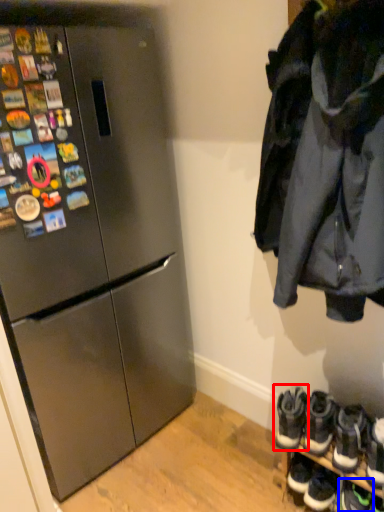
Question: Which object is further to the camera taking this photo, footwear (highlighted by a red box) or footwear (highlighted by a blue box)?

Choices:
 (A) footwear
 (B) footwear

Answer: (A)